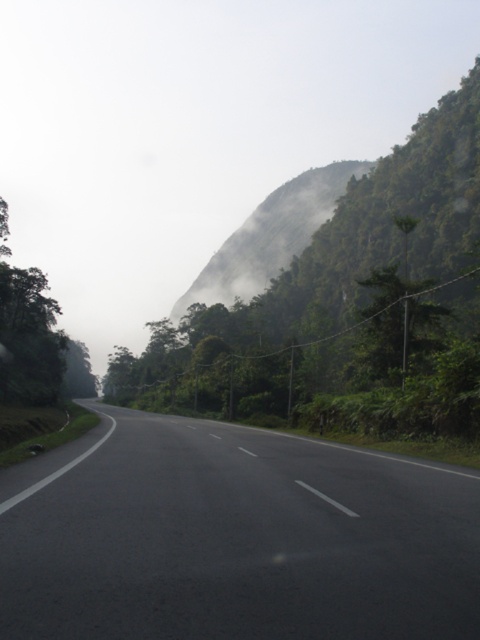
You are driving a car and see the black asphalt highway at center and the green leafy tree at upper center in your view. Which object appears larger in your view?

The green leafy tree at upper center appears larger in your view because it is described as having a larger size compared to the black asphalt highway at center.

Based on the photo, you are a GPS navigator planning a route for a car traveling along the black asphalt highway at center. The car needs to reach a destination located at point 0.841, 0.485. Is the car currently on the correct path to reach the destination?

The black asphalt highway at center is already located at point [232,538], so the car is already at the destination.

From the picture: You are driving a truck that is 2.5 meters wide. You see the black asphalt highway at center and the green leafy mountain at upper center. Which one has a greater width?

The green leafy mountain at upper center has a greater width than the black asphalt highway at center.